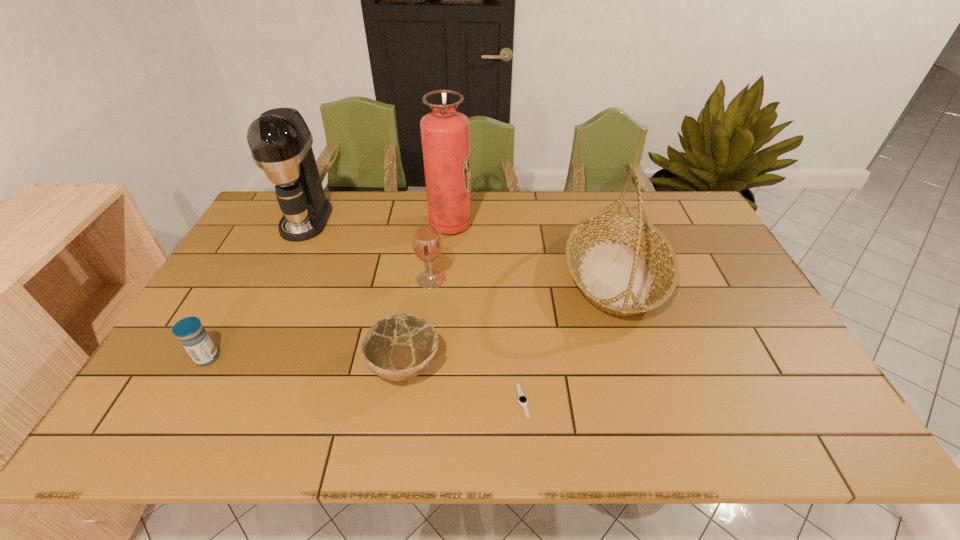
Image resolution: width=960 pixels, height=540 pixels. I want to click on fire extinguisher, so click(x=445, y=133).

At what (x,y) coordinates should I click in order to perform the action: click on coffee maker. Please return your answer as a coordinate pair (x, y). The height and width of the screenshot is (540, 960). Looking at the image, I should click on (280, 142).

This screenshot has height=540, width=960. Identify the location of basket. (622, 264).

Image resolution: width=960 pixels, height=540 pixels. Identify the location of the fifth shortest object. (622, 264).

Where is `wineglass`? This screenshot has height=540, width=960. wineglass is located at coordinates (427, 241).

Image resolution: width=960 pixels, height=540 pixels. Find the location of `medicine`. medicine is located at coordinates (193, 337).

Identify the location of bowl. (397, 348).

Where is `the second object from right to left`? This screenshot has width=960, height=540. the second object from right to left is located at coordinates (522, 399).

The image size is (960, 540). Identify the location of watch. (522, 399).

The width and height of the screenshot is (960, 540). I want to click on vacant space situated on the label side of the fire extinguisher, so click(x=558, y=225).